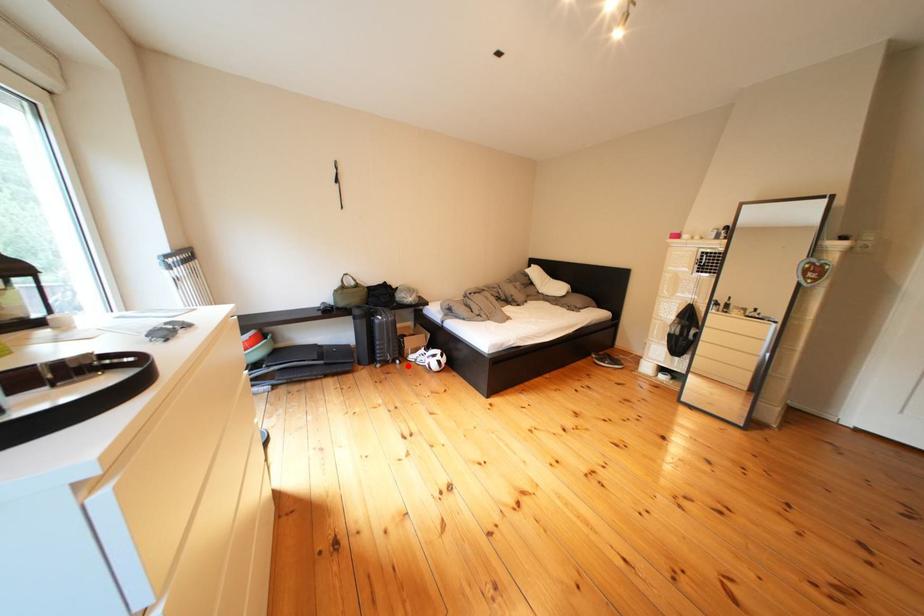
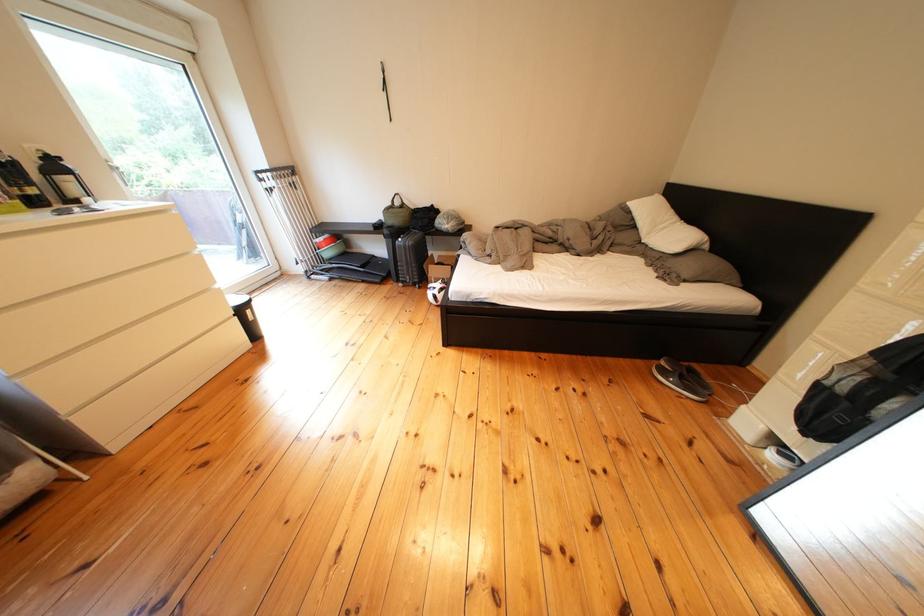
In the second image, find the point that corresponds to the highlighted location in the first image.

(429, 290)